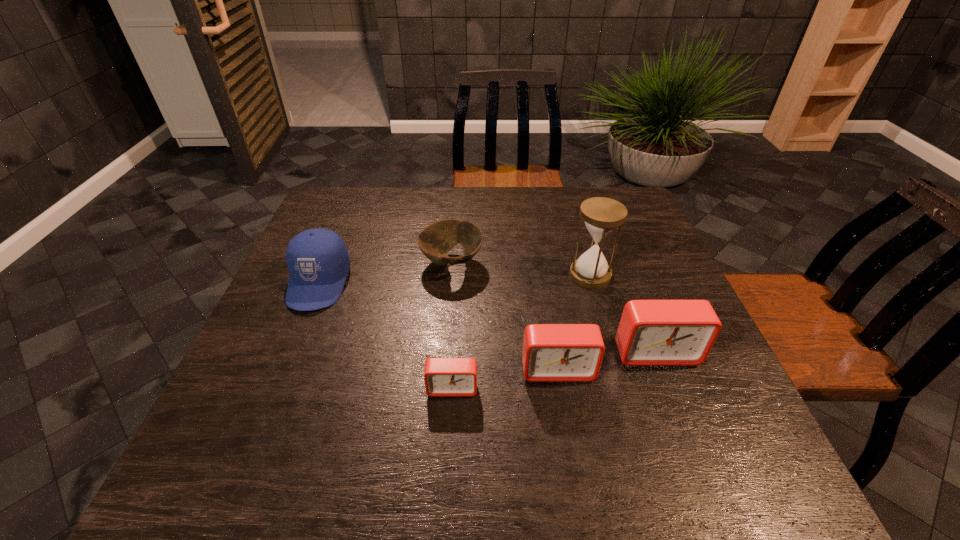
Locate an element on the screen. The width and height of the screenshot is (960, 540). free spot between the hourglass and the shortest alarm clock is located at coordinates coord(521,332).

I want to click on empty space between the second alarm clock from right to left and the bowl, so click(x=505, y=316).

Image resolution: width=960 pixels, height=540 pixels. I want to click on vacant space in between the bowl and the rightmost alarm clock, so click(554, 308).

At what (x,y) coordinates should I click in order to perform the action: click on vacant space that's between the leftmost object and the bowl. Please return your answer as a coordinate pair (x, y). Looking at the image, I should click on 385,273.

This screenshot has width=960, height=540. What are the coordinates of `vacant space in between the cap and the second tallest alarm clock` in the screenshot? It's located at (438, 326).

The width and height of the screenshot is (960, 540). I want to click on free space between the cap and the second tallest alarm clock, so click(438, 326).

Where is `vacant point located between the cap and the bowl`? This screenshot has width=960, height=540. vacant point located between the cap and the bowl is located at coordinates (385, 273).

Identify which object is the fourth nearest to the tallest object. Please provide its 2D coordinates. Your answer should be formatted as a tuple, i.e. [(x, y)], where the tuple contains the x and y coordinates of a point satisfying the conditions above.

[(443, 376)]

This screenshot has width=960, height=540. What are the coordinates of `the third closest object to the leftmost object` in the screenshot? It's located at (551, 352).

Locate which alarm clock ranks second in proximity to the bowl. Please provide its 2D coordinates. Your answer should be formatted as a tuple, i.e. [(x, y)], where the tuple contains the x and y coordinates of a point satisfying the conditions above.

[(443, 376)]